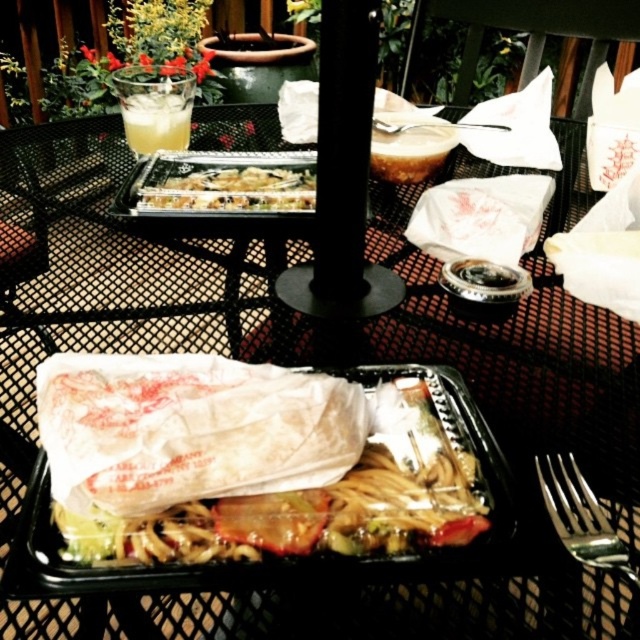
You are a server at the restaurant and need to place a 12 inch long bottle of ketchup between the wooden chair at upper center and the clear glass cup at upper left. Is there enough space between them to fit the bottle?

The wooden chair at upper center and clear glass cup at upper left are 34.17 inches apart from each other. Since the bottle is only 12 inches long, there is sufficient space to place it between them.

In the scene shown: You are sitting at the table and want to reach for an item. Which of the two points, point [525,70] or point [134,104], is closer to you?

Point [134,104] is closer to you because point [525,70] is behind it.

You are sitting at the table and want to grab the clear glass cup at upper left. Is the wooden chair at upper center blocking your path to it?

The wooden chair at upper center is further to the viewer than the clear glass cup at upper left, so the chair is between you and the cup. Therefore, the wooden chair at upper center is blocking your path to the clear glass cup at upper left.